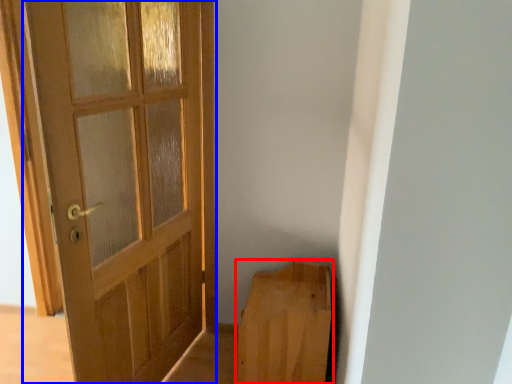
Question: Among these objects, which one is nearest to the camera, furniture (highlighted by a red box) or door (highlighted by a blue box)?

Choices:
 (A) furniture
 (B) door

Answer: (B)